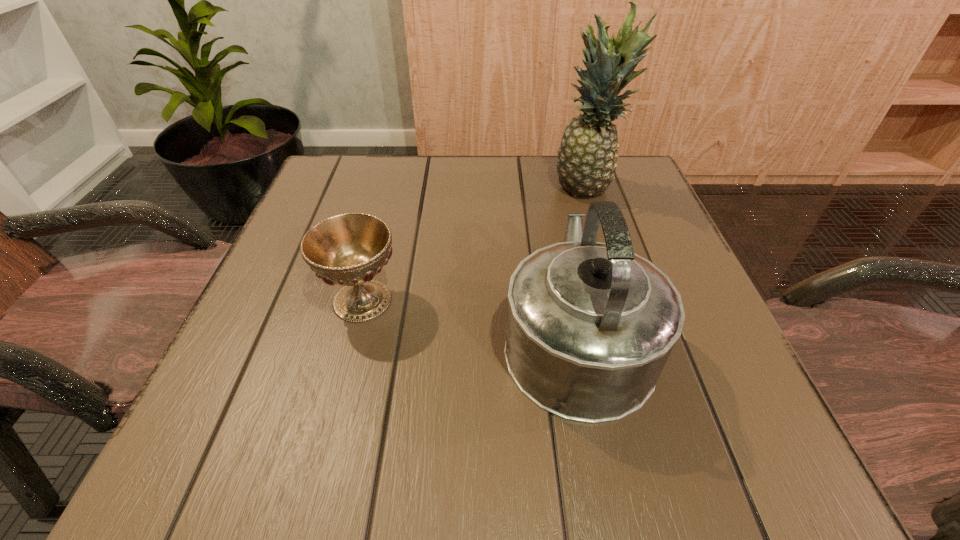
Identify the location of pineapple. (587, 157).

Image resolution: width=960 pixels, height=540 pixels. I want to click on the farthest object, so click(587, 157).

The image size is (960, 540). I want to click on kettle, so click(x=590, y=326).

Where is `chalice`? Image resolution: width=960 pixels, height=540 pixels. chalice is located at coordinates point(349,249).

Locate an element on the screen. the leftmost object is located at coordinates (349, 249).

What are the coordinates of `free space located on the left of the farthest object` in the screenshot? It's located at (518, 189).

Identify the location of vacant space located with the spout at the front of the kettle. The height and width of the screenshot is (540, 960). (552, 214).

The image size is (960, 540). I want to click on free space located 0.260m with the spout at the front of the kettle, so click(547, 191).

Where is `free location located with the spout at the front of the kettle`? free location located with the spout at the front of the kettle is located at coordinates (545, 181).

The image size is (960, 540). I want to click on free region located on the back of the chalice, so click(383, 220).